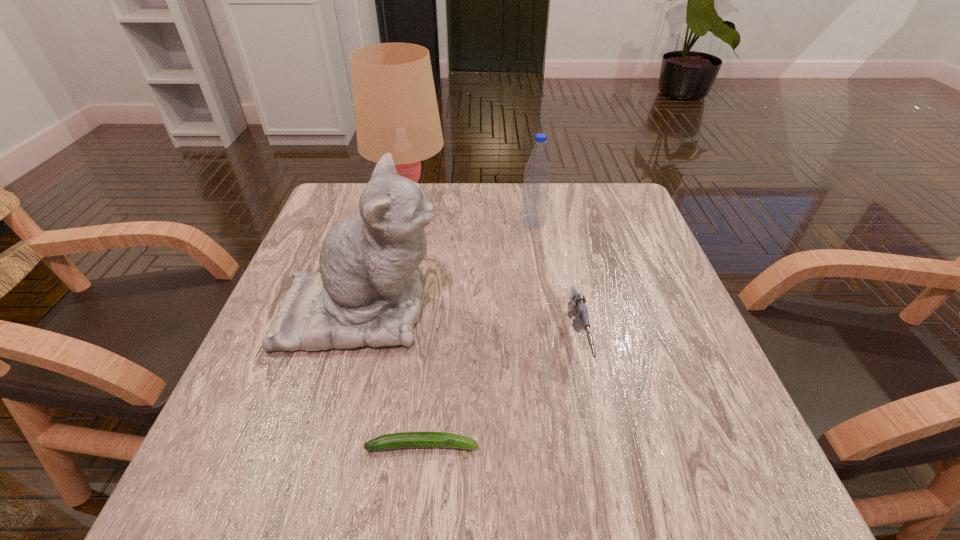
This screenshot has height=540, width=960. Find the location of `free point at the near edge`. free point at the near edge is located at coordinates (361, 467).

This screenshot has width=960, height=540. Find the location of `vacant space at the right edge`. vacant space at the right edge is located at coordinates (679, 380).

Identify the location of free region at the far left corner of the desktop. This screenshot has width=960, height=540. (331, 189).

Where is `vacant space at the near left corner`? vacant space at the near left corner is located at coordinates (194, 478).

The image size is (960, 540). In the image, there is a desktop. Identify the location of vacant space at the far right corner. point(585,225).

Find the location of a particular element. This screenshot has width=960, height=540. free space between the fourth shortest object and the third tallest object is located at coordinates (447, 265).

You are a GUI agent. You are given a task and a screenshot of the screen. Output one action in this format:
    pyautogui.click(x=<x>, y=<y>)
    Task: Click on the free space between the third shortest object and the gun
    This screenshot has width=960, height=540.
    Given the screenshot: What is the action you would take?
    pyautogui.click(x=555, y=284)

Where is `free space between the cat and the fourth tallest object`? free space between the cat and the fourth tallest object is located at coordinates (468, 328).

The width and height of the screenshot is (960, 540). I want to click on free space that is in between the nearest object and the fourth shortest object, so click(x=392, y=377).

Locate an element on the screen. free spot between the gun and the lampshade is located at coordinates (492, 275).